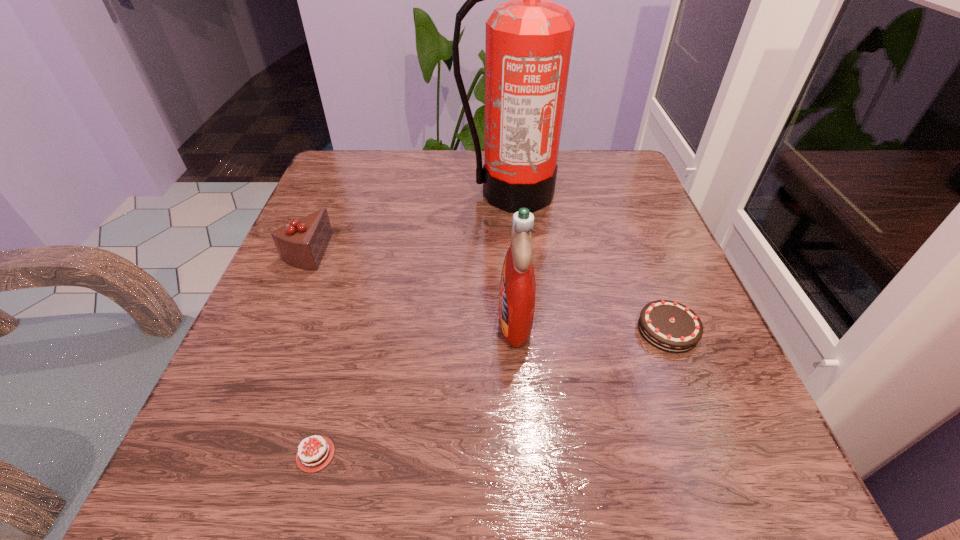
I want to click on vacant space that satisfies the following two spatial constraints: 1. on the front side of the second tallest chocolate cake; 2. on the right side of the fire extinguisher, so click(x=523, y=330).

At what (x,y) coordinates should I click in order to perform the action: click on free space that satisfies the following two spatial constraints: 1. on the front surface of the detergent; 2. on the right side of the rightmost chocolate cake. Please return your answer as a coordinate pair (x, y). This screenshot has width=960, height=540. Looking at the image, I should click on (516, 330).

At what (x,y) coordinates should I click in order to perform the action: click on vacant space that satisfies the following two spatial constraints: 1. on the back side of the shortest chocolate cake; 2. on the left side of the second shortest object. Please return your answer as a coordinate pair (x, y). Looking at the image, I should click on (349, 330).

I want to click on free spot that satisfies the following two spatial constraints: 1. on the back side of the second tallest chocolate cake; 2. on the right side of the second chocolate cake from right to left, so click(x=349, y=330).

This screenshot has width=960, height=540. Identify the location of vacant point that satisfies the following two spatial constraints: 1. on the front surface of the second tallest object; 2. on the left side of the second tallest chocolate cake. (516, 330).

Image resolution: width=960 pixels, height=540 pixels. Identify the location of blank space that satisfies the following two spatial constraints: 1. on the front side of the tallest object; 2. on the front surface of the fourth shortest object. (523, 320).